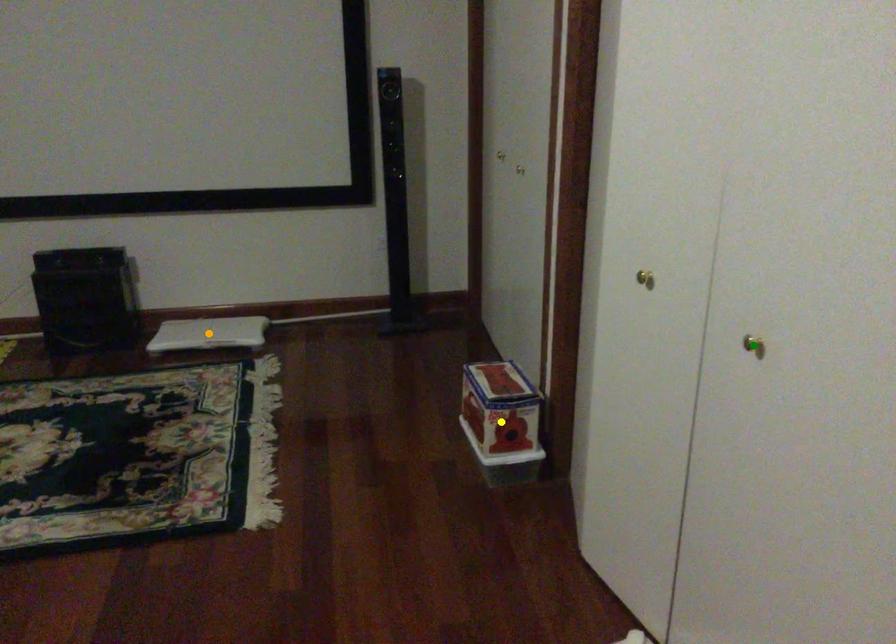
Order these from nearest to farthest:
green point
yellow point
orange point

orange point, yellow point, green point